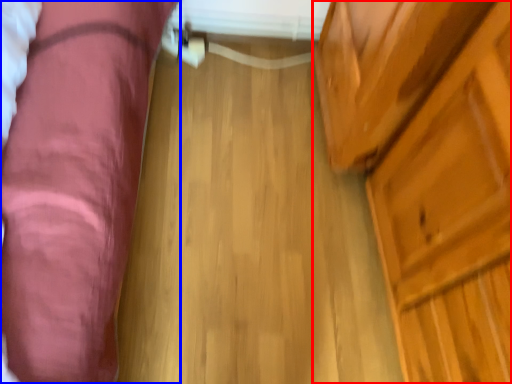
Question: Which point is further to the camera, dresser (highlighted by a red box) or furniture (highlighted by a blue box)?

Choices:
 (A) dresser
 (B) furniture

Answer: (B)